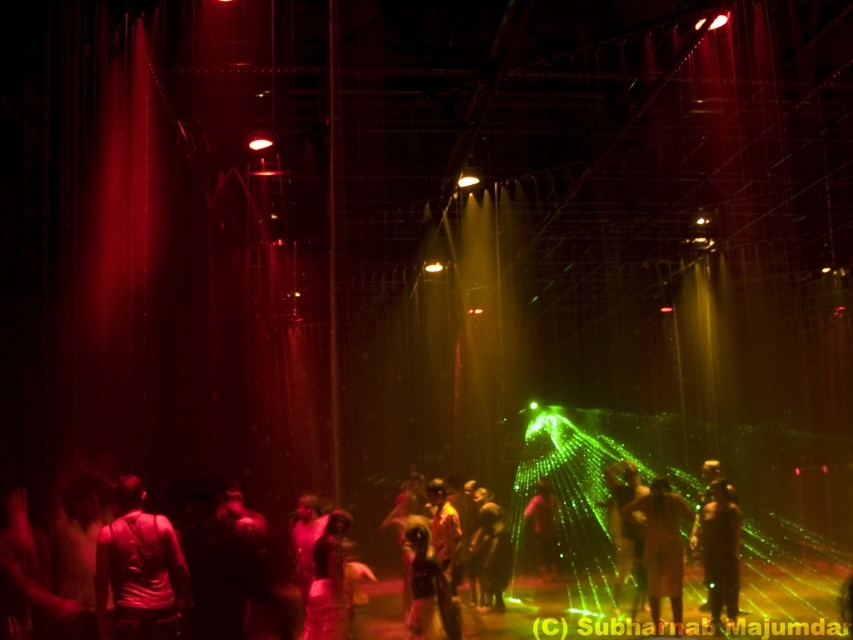
Does matte black shirt at lower left appear on the right side of shiny metallic dress at center?

In fact, matte black shirt at lower left is to the left of shiny metallic dress at center.

Does matte black shirt at lower left appear under shiny metallic dress at center?

No, matte black shirt at lower left is not below shiny metallic dress at center.

I want to click on matte black shirt at lower left, so click(x=138, y=570).

Is matte black shirt at lower left closer to the viewer compared to silky brown dress at center?

Yes, it is.

What do you see at coordinates (138, 570) in the screenshot?
I see `matte black shirt at lower left` at bounding box center [138, 570].

Is point (120, 621) closer to camera compared to point (648, 502)?

That is True.

At what (x,y) coordinates should I click in order to perform the action: click on matte black shirt at lower left. Please return your answer as a coordinate pair (x, y). Looking at the image, I should click on (138, 570).

Describe the element at coordinates (625, 529) in the screenshot. This screenshot has width=853, height=640. I see `metallic gold person at center` at that location.

Identify the location of metallic gold person at center. (625, 529).